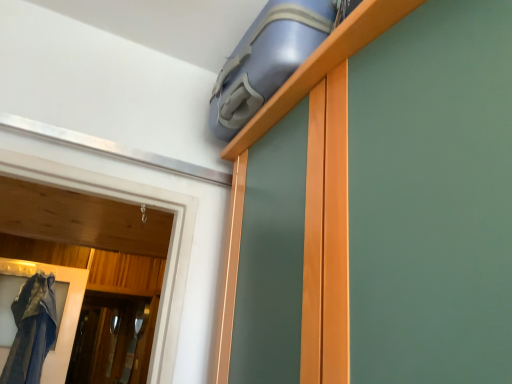
Question: Should I look upward or downward to see blue rubber suitcase at upper center?

Choices:
 (A) up
 (B) down

Answer: (A)

Question: Is blue rubber suitcase at upper center not within transparent glass screen door at lower left?

Choices:
 (A) no
 (B) yes

Answer: (B)

Question: Is blue rubber suitcase at upper center oriented away from transparent glass screen door at lower left?

Choices:
 (A) no
 (B) yes

Answer: (A)

Question: Can you confirm if blue rubber suitcase at upper center is positioned to the right of transparent glass screen door at lower left?

Choices:
 (A) no
 (B) yes

Answer: (B)

Question: Considering the relative sizes of blue rubber suitcase at upper center and transparent glass screen door at lower left in the image provided, is blue rubber suitcase at upper center thinner than transparent glass screen door at lower left?

Choices:
 (A) no
 (B) yes

Answer: (A)

Question: Could you tell me if blue rubber suitcase at upper center is facing transparent glass screen door at lower left?

Choices:
 (A) no
 (B) yes

Answer: (A)

Question: Is blue rubber suitcase at upper center further to the viewer compared to transparent glass screen door at lower left?

Choices:
 (A) no
 (B) yes

Answer: (A)

Question: Considering the relative sizes of transparent glass screen door at lower left and blue rubber suitcase at upper center in the image provided, is transparent glass screen door at lower left wider than blue rubber suitcase at upper center?

Choices:
 (A) yes
 (B) no

Answer: (B)

Question: Is the position of transparent glass screen door at lower left more distant than that of blue rubber suitcase at upper center?

Choices:
 (A) yes
 (B) no

Answer: (A)

Question: Is transparent glass screen door at lower left positioned beyond the bounds of blue rubber suitcase at upper center?

Choices:
 (A) no
 (B) yes

Answer: (B)

Question: Are transparent glass screen door at lower left and blue rubber suitcase at upper center beside each other?

Choices:
 (A) no
 (B) yes

Answer: (A)

Question: Is transparent glass screen door at lower left looking in the opposite direction of blue rubber suitcase at upper center?

Choices:
 (A) yes
 (B) no

Answer: (B)

Question: Considering the relative sizes of transparent glass screen door at lower left and blue rubber suitcase at upper center in the image provided, is transparent glass screen door at lower left smaller than blue rubber suitcase at upper center?

Choices:
 (A) yes
 (B) no

Answer: (A)

Question: From a real-world perspective, relative to blue rubber suitcase at upper center, is transparent glass screen door at lower left vertically above or below?

Choices:
 (A) below
 (B) above

Answer: (A)